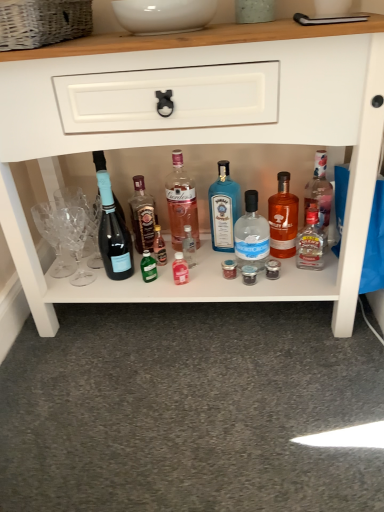
Question: Is matte glass bottle at center, which appears as the second bottle when viewed from the left, further to camera compared to blue glass bottle at center, marked as the fourth bottle in a left-to-right arrangement?

Choices:
 (A) yes
 (B) no

Answer: (A)

Question: From the image's perspective, is matte glass bottle at center, which appears as the second bottle when viewed from the left, above blue glass bottle at center, marked as the fourth bottle in a left-to-right arrangement?

Choices:
 (A) yes
 (B) no

Answer: (B)

Question: Is matte glass bottle at center, arranged as the sixth bottle when viewed from the right, taller than blue glass bottle at center, the fourth bottle positioned from the right?

Choices:
 (A) no
 (B) yes

Answer: (B)

Question: Is matte glass bottle at center, arranged as the sixth bottle when viewed from the right, to the right of blue glass bottle at center, the fourth bottle positioned from the right, from the viewer's perspective?

Choices:
 (A) yes
 (B) no

Answer: (B)

Question: From a real-world perspective, does matte glass bottle at center, which appears as the second bottle when viewed from the left, stand above blue glass bottle at center, marked as the fourth bottle in a left-to-right arrangement?

Choices:
 (A) yes
 (B) no

Answer: (B)

Question: Can you confirm if matte glass bottle at center, which appears as the second bottle when viewed from the left, is wider than blue glass bottle at center, marked as the fourth bottle in a left-to-right arrangement?

Choices:
 (A) yes
 (B) no

Answer: (B)

Question: Considering the relative positions of woven wicker basket at upper left and white glossy shelf at center in the image provided, is woven wicker basket at upper left in front of white glossy shelf at center?

Choices:
 (A) yes
 (B) no

Answer: (B)

Question: Does woven wicker basket at upper left come behind white glossy shelf at center?

Choices:
 (A) yes
 (B) no

Answer: (A)

Question: Is woven wicker basket at upper left thinner than white glossy shelf at center?

Choices:
 (A) yes
 (B) no

Answer: (B)

Question: Is woven wicker basket at upper left not within white glossy shelf at center?

Choices:
 (A) yes
 (B) no

Answer: (A)

Question: From the image's perspective, would you say woven wicker basket at upper left is positioned over white glossy shelf at center?

Choices:
 (A) no
 (B) yes

Answer: (B)

Question: Could you tell me if woven wicker basket at upper left is turned towards white glossy shelf at center?

Choices:
 (A) no
 (B) yes

Answer: (A)

Question: From the image's perspective, is pink glass bottle at center, placed as the fifth bottle when sorted from right to left, under transparent glass bottle at center, arranged as the 5th bottle when viewed from the left?

Choices:
 (A) no
 (B) yes

Answer: (A)